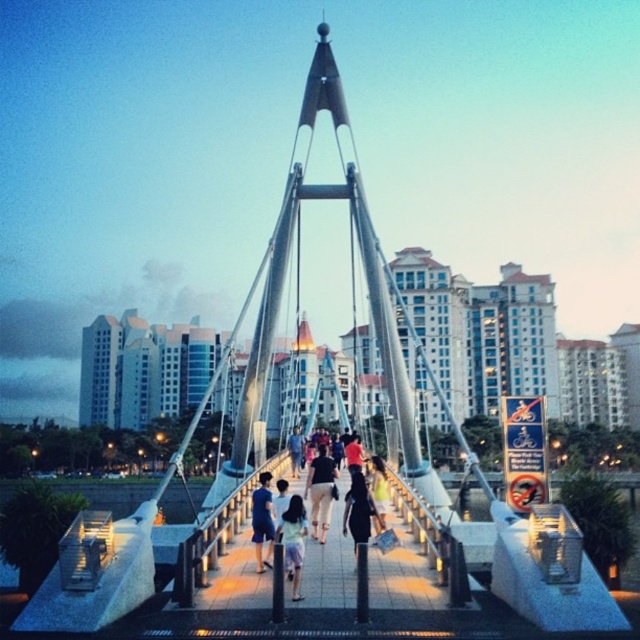
Does blue fabric at center have a greater height compared to light brown fabric dress at center?

Yes.

From the picture: Can you confirm if blue fabric at center is positioned to the right of light brown fabric dress at center?

Incorrect, blue fabric at center is not on the right side of light brown fabric dress at center.

Between point (262, 557) and point (378, 509), which one is positioned behind?

Point (378, 509)

At what (x,y) coordinates should I click in order to perform the action: click on blue fabric at center. Please return your answer as a coordinate pair (x, y). This screenshot has width=640, height=640. Looking at the image, I should click on (262, 520).

Between point (360, 513) and point (296, 460), which one is positioned in front?

Point (360, 513) is more forward.

Is black fabric dress at center behind blue denim jeans at center?

No, black fabric dress at center is in front of blue denim jeans at center.

Where is `black fabric dress at center`? The height and width of the screenshot is (640, 640). black fabric dress at center is located at coordinates (x=358, y=509).

Which is behind, point (256, 541) or point (291, 445)?

The point (291, 445) is more distant.

Between blue fabric at center and blue denim jeans at center, which one has more height?

Standing taller between the two is blue fabric at center.

The height and width of the screenshot is (640, 640). In order to click on blue fabric at center in this screenshot , I will do `click(262, 520)`.